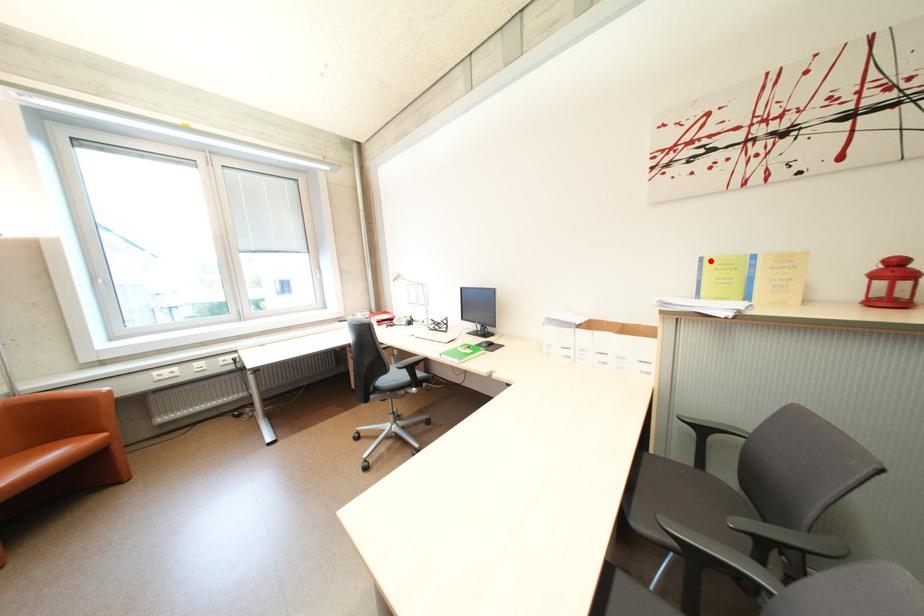
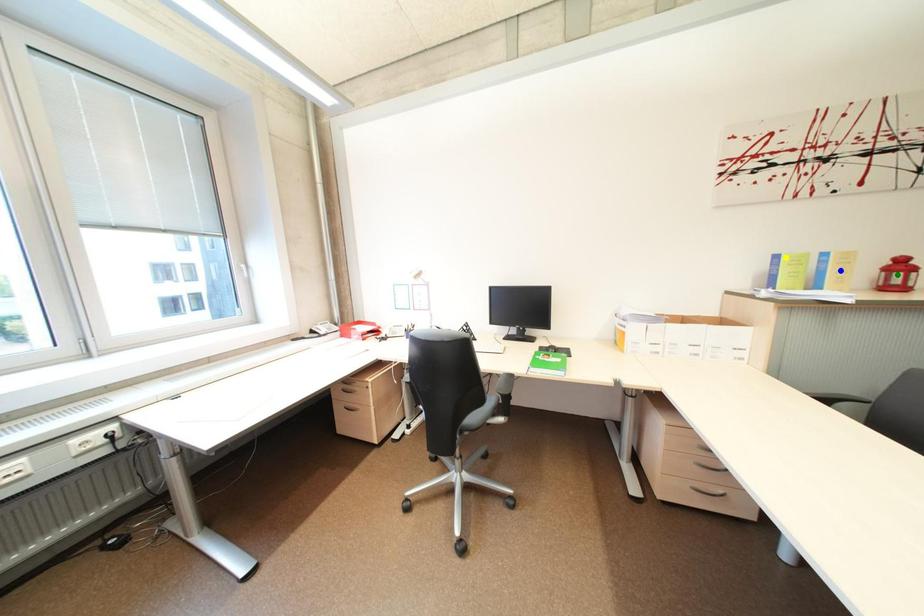
Question: I am providing you with two images of the same scene from different viewpoints. A red point is marked on the first image. You are given multiple points on the second image. Which point in image 2 is actually the same real-world point as the red point in image 1?

Choices:
 (A) yellow point
 (B) blue point
 (C) green point

Answer: (A)